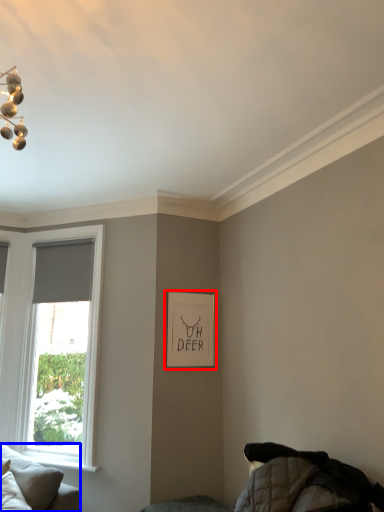
Question: Among these objects, which one is nearest to the camera, picture frame (highlighted by a red box) or studio couch (highlighted by a blue box)?

Choices:
 (A) picture frame
 (B) studio couch

Answer: (B)